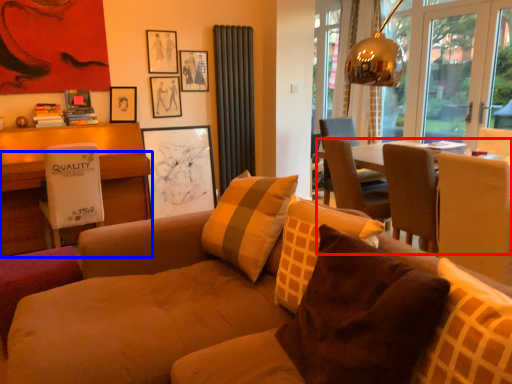
Question: Among these objects, which one is farthest to the camera, table (highlighted by a red box) or desk (highlighted by a blue box)?

Choices:
 (A) table
 (B) desk

Answer: (B)